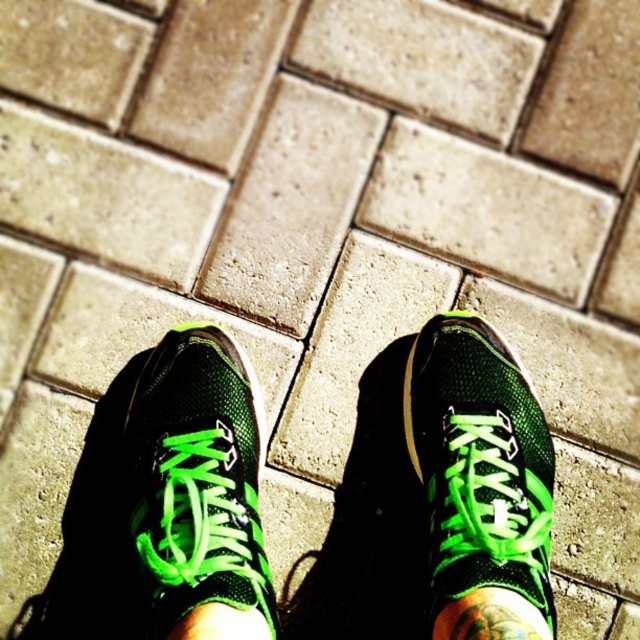
You are standing in front of the paved surface with two points marked on it. You want to place a small plant pot exactly halfway between point (x=516, y=588) and point (x=488, y=630). Considering the spatial relationship between these points, will the plant pot be closer to the viewer or further away from you?

The plant pot placed halfway between point (x=516, y=588) and point (x=488, y=630) will be closer to the viewer because point (x=516, y=588) is further to the viewer than point (x=488, y=630), so the midpoint would be closer to the nearer point.

You are trying to determine which item is closer to you between the green mesh shoe at center and the green mesh sock at center. Based on the scene, which one is positioned closer?

The green mesh shoe at center is positioned closer to you because it is in front of the green mesh sock at center.

You are standing 1.00 meters away from the green mesh shoe at center. If you want to take a photo of it using a camera that has a minimum focus distance of 0.5 meters, will you be able to capture it clearly?

Yes, because you are standing 1.00 meters away from the green mesh shoe at center, which is within the camera minimum focus distance of 0.5 meters. Therefore, the camera can focus on the green mesh shoe at center clearly.